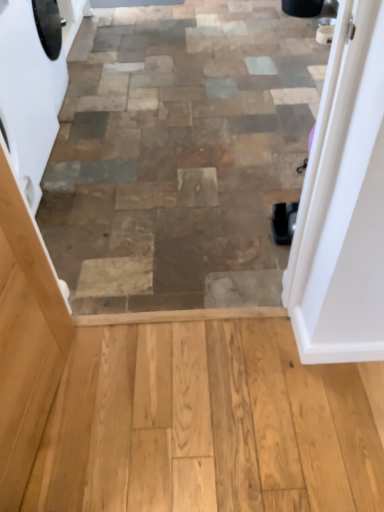
At what (x,y) coordinates should I click in order to perform the action: click on white glossy door at upper right. Please return your answer as a coordinate pair (x, y). The height and width of the screenshot is (512, 384). Looking at the image, I should click on (343, 203).

The height and width of the screenshot is (512, 384). What do you see at coordinates (29, 94) in the screenshot?
I see `white glossy washing machine at left` at bounding box center [29, 94].

Find the location of a particular element. Image resolution: width=384 pixels, height=512 pixels. white glossy door at upper right is located at coordinates (343, 203).

Find the location of a particular element. door that appears above the light brown wood screen door at left (from the image's perspective) is located at coordinates (343, 203).

Which object is thinner, light brown wood screen door at left or white glossy door at upper right?

light brown wood screen door at left is thinner.

From a real-world perspective, is light brown wood screen door at left on top of white glossy door at upper right?

No, from a real-world perspective, light brown wood screen door at left is not above white glossy door at upper right.

What's the angular difference between light brown wood screen door at left and white glossy door at upper right's facing directions?

90.9 degrees.

From the image's perspective, is white glossy washing machine at left positioned above or below light brown wood screen door at left?

white glossy washing machine at left is above light brown wood screen door at left.

Is white glossy washing machine at left positioned in front of light brown wood screen door at left?

No, it is behind light brown wood screen door at left.

Is point (35, 192) more distant than point (39, 398)?

Yes, point (35, 192) is behind point (39, 398).

Is light brown wood screen door at left at the back of white glossy washing machine at left?

That's not correct — white glossy washing machine at left is not looking away from light brown wood screen door at left.

In terms of height, does white glossy washing machine at left look taller or shorter compared to white glossy door at upper right?

white glossy washing machine at left is shorter than white glossy door at upper right.

Which object is more forward, white glossy washing machine at left or white glossy door at upper right?

white glossy door at upper right is more forward.

Considering the sizes of objects white glossy washing machine at left and white glossy door at upper right in the image provided, who is thinner, white glossy washing machine at left or white glossy door at upper right?

white glossy door at upper right.

The image size is (384, 512). Find the location of `door above the light brown wood screen door at left (from the image's perspective)`. door above the light brown wood screen door at left (from the image's perspective) is located at coordinates (343, 203).

Is white glossy door at upper right not close to light brown wood screen door at left?

No, there isn't a large distance between white glossy door at upper right and light brown wood screen door at left.

Which of these two, white glossy door at upper right or light brown wood screen door at left, stands shorter?

light brown wood screen door at left.

From the image's perspective, relative to light brown wood screen door at left, is white glossy door at upper right above or below?

white glossy door at upper right is above light brown wood screen door at left.

Is white glossy washing machine at left inside white glossy door at upper right?

No, white glossy washing machine at left is not a part of white glossy door at upper right.

From the image's perspective, does white glossy door at upper right appear higher than white glossy washing machine at left?

No, from the image's perspective, white glossy door at upper right is not on top of white glossy washing machine at left.

Which object is further away from the camera, white glossy door at upper right or white glossy washing machine at left?

white glossy washing machine at left is further from the camera.

Is white glossy door at upper right to the right of white glossy washing machine at left from the viewer's perspective?

Correct, you'll find white glossy door at upper right to the right of white glossy washing machine at left.

How distant is light brown wood screen door at left from white glossy washing machine at left?

light brown wood screen door at left is 92.56 centimeters from white glossy washing machine at left.

The image size is (384, 512). Identify the location of screen door below the white glossy washing machine at left (from the image's perspective). (25, 337).

Considering their positions, is light brown wood screen door at left located in front of or behind white glossy washing machine at left?

Clearly, light brown wood screen door at left is in front of white glossy washing machine at left.

Is light brown wood screen door at left oriented towards white glossy washing machine at left?

No, light brown wood screen door at left does not turn towards white glossy washing machine at left.

The height and width of the screenshot is (512, 384). Find the location of `door located behind the light brown wood screen door at left`. door located behind the light brown wood screen door at left is located at coordinates (343, 203).

This screenshot has width=384, height=512. I want to click on washing machine that appears above the light brown wood screen door at left (from the image's perspective), so click(x=29, y=94).

Looking at this image, when comparing their distances from light brown wood screen door at left, does white glossy washing machine at left or white glossy door at upper right seem further?

Based on the image, white glossy washing machine at left appears to be further to light brown wood screen door at left.

Which object lies nearer to the anchor point white glossy washing machine at left, white glossy door at upper right or light brown wood screen door at left?

light brown wood screen door at left is positioned closer to the anchor white glossy washing machine at left.

Which object lies nearer to the anchor point white glossy door at upper right, light brown wood screen door at left or white glossy washing machine at left?

Based on the image, light brown wood screen door at left appears to be nearer to white glossy door at upper right.

Estimate the real-world distances between objects in this image. Which object is further from white glossy washing machine at left, light brown wood screen door at left or white glossy door at upper right?

white glossy door at upper right.

Considering their positions, is white glossy door at upper right positioned closer to light brown wood screen door at left than white glossy washing machine at left?

white glossy door at upper right lies closer to light brown wood screen door at left than the other object.

Which object lies further to the anchor point white glossy door at upper right, white glossy washing machine at left or light brown wood screen door at left?

Among the two, white glossy washing machine at left is located further to white glossy door at upper right.

Identify the location of screen door between white glossy washing machine at left and white glossy door at upper right in the horizontal direction. (25, 337).